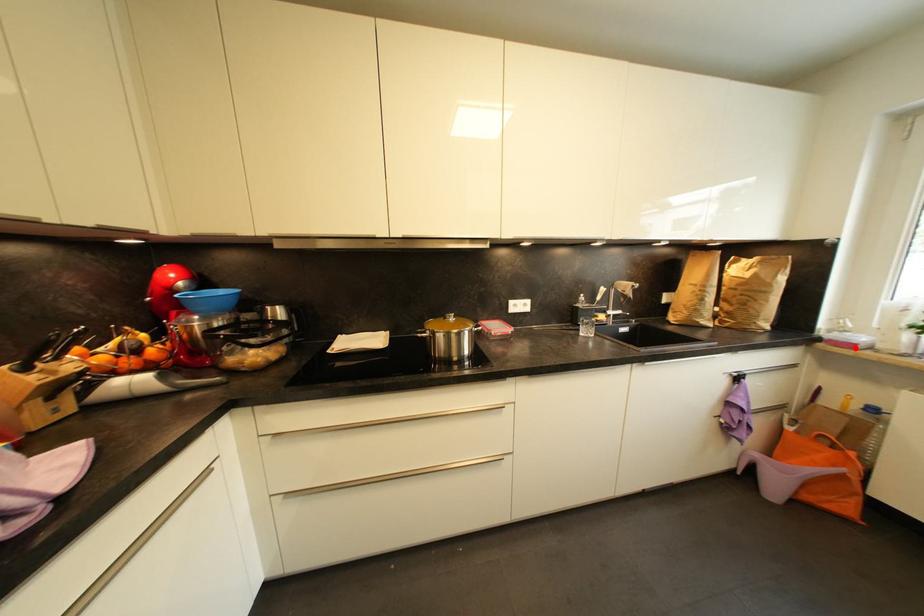
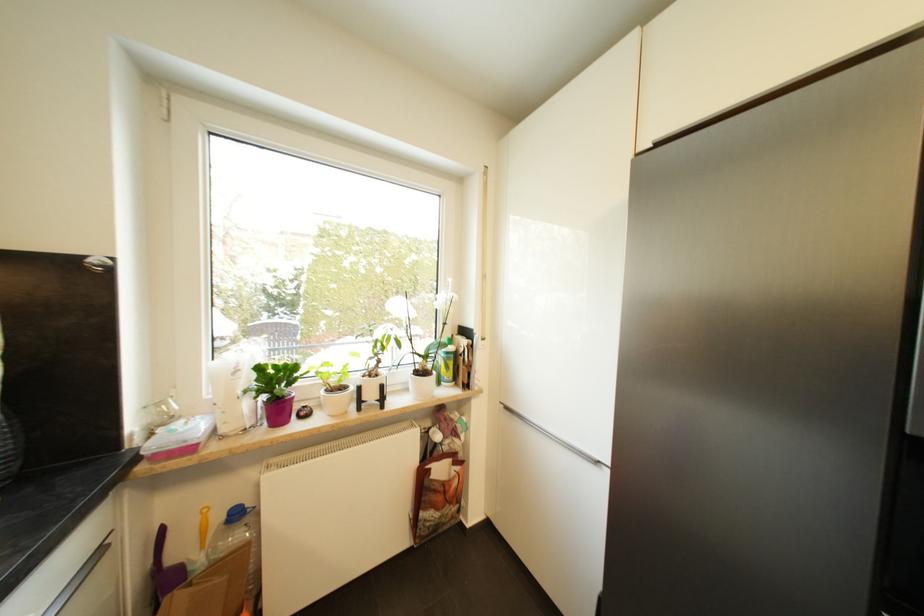
The point at the highlighted location is marked in the first image. Where is the corresponding point in the second image?

(195, 451)